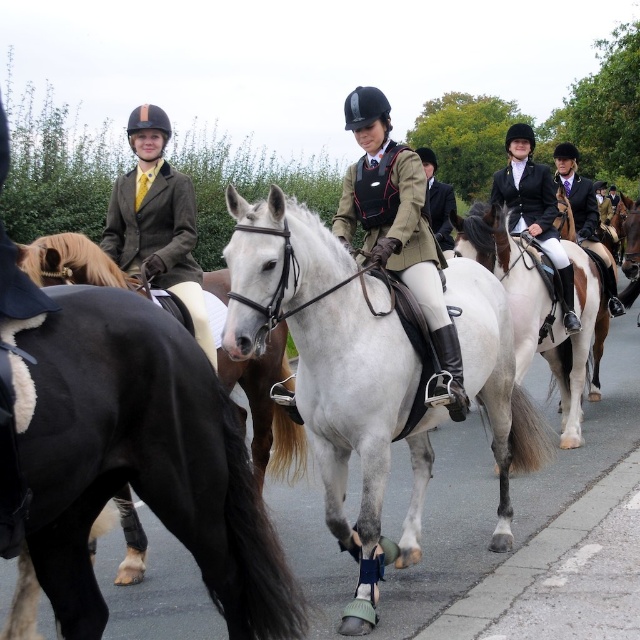
In the scene shown: Based on the scene description, where is the white glossy horse at center located in terms of its 2D coordinates?

The white glossy horse at center is located at the 2D coordinates of point (445, 532).